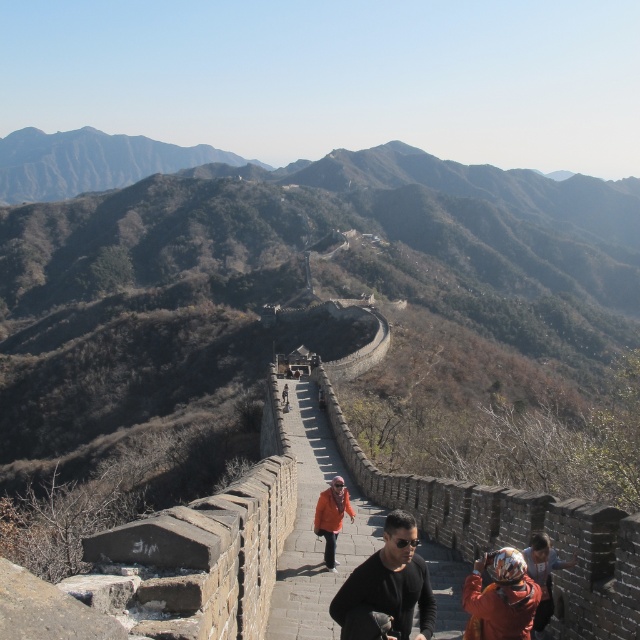
You are a tour guide leading a group on the Great Wall and need to ensure everyone stays within a safe distance. The recommended safe distance between visitors is 5 meters. Are the two visitors wearing the black matte jacket at center and the orange fabric headscarf at lower right within the safe distance?

The black matte jacket at center is 5.89 meters away from the orange fabric headscarf at lower right. Since the recommended safe distance is 5 meters, they are slightly beyond the recommended distance.

You are standing on the Great Wall of China and notice an orange fabric headscarf at lower right. If you want to retrieve it, which direction should you move relative to your current position?

You should move towards the lower right direction to retrieve the orange fabric headscarf at lower right, as it is located at point (544, 576).

You are a photographer visiting the Great Wall and notice two orange items in the scene. One is an orange fabric headscarf at lower right and the other is an orange fabric jacket at center. From your vantage point, which orange item appears higher up in the image?

The orange fabric headscarf at lower right is located above the orange fabric jacket at center, so the headscarf appears higher up in the image.